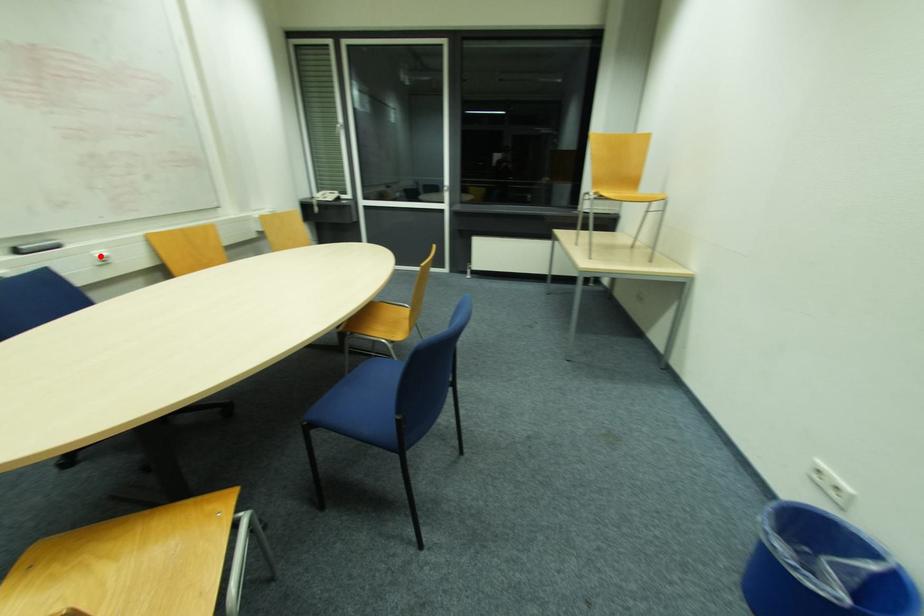
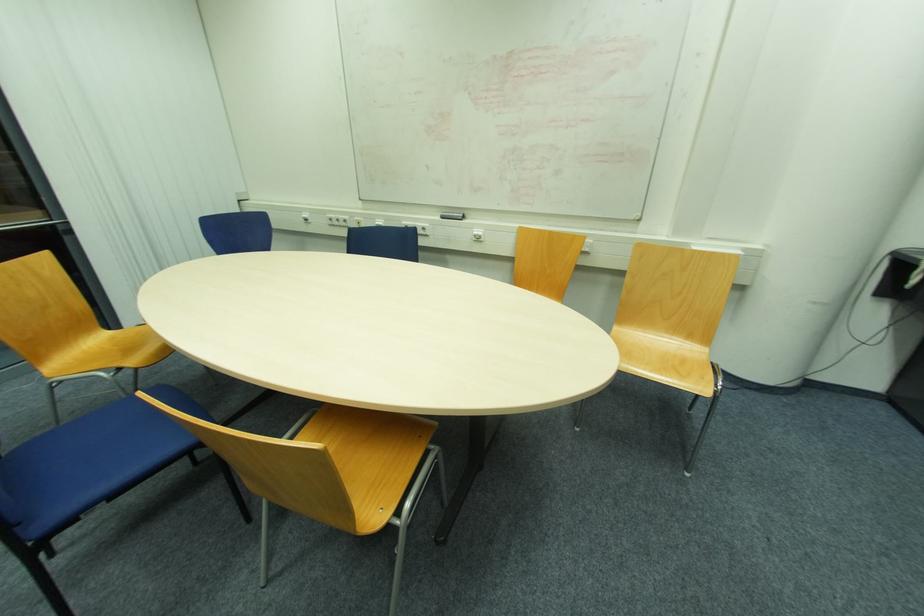
Locate, in the second image, the point that corresponds to the highlighted location in the first image.

(477, 233)